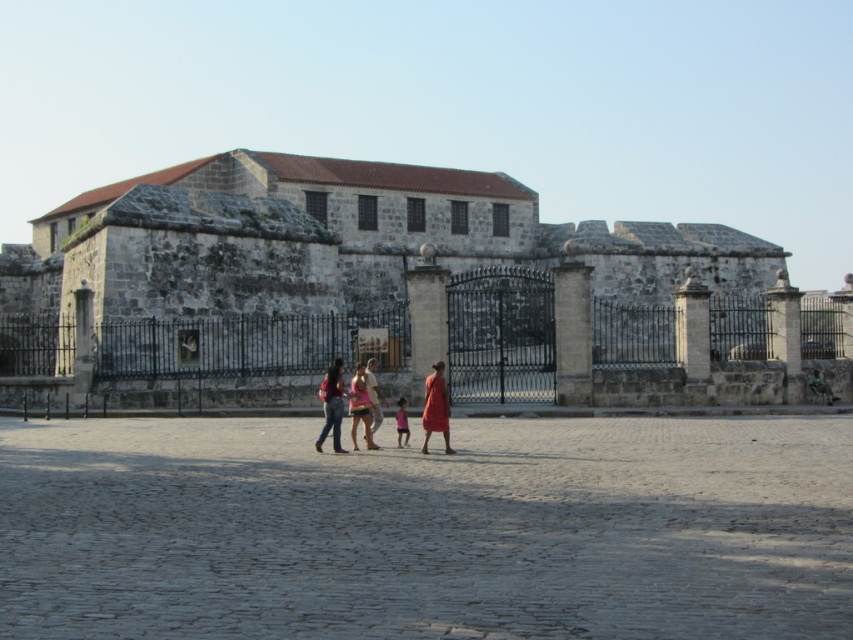
Looking at this image, can you confirm if gray cobblestone plaza at center is positioned below matte black pants at center?

Yes, gray cobblestone plaza at center is below matte black pants at center.

Between gray cobblestone plaza at center and matte black pants at center, which one has less height?

Standing shorter between the two is gray cobblestone plaza at center.

You are a GUI agent. You are given a task and a screenshot of the screen. Output one action in this format:
    pyautogui.click(x=<x>, y=<y>)
    Task: Click on the gray cobblestone plaza at center
    This screenshot has width=853, height=640.
    Given the screenshot: What is the action you would take?
    pyautogui.click(x=427, y=531)

Is matte black pants at center smaller than pink satin dress at center?

Incorrect, matte black pants at center is not smaller in size than pink satin dress at center.

Image resolution: width=853 pixels, height=640 pixels. Describe the element at coordinates (331, 404) in the screenshot. I see `matte black pants at center` at that location.

Which is behind, point (328, 384) or point (360, 401)?

The point (328, 384) is behind.

At what (x,y) coordinates should I click in order to perform the action: click on matte black pants at center. Please return your answer as a coordinate pair (x, y). Image resolution: width=853 pixels, height=640 pixels. Looking at the image, I should click on (331, 404).

Can you confirm if matte orange dress at center is positioned below pink fabric dress at center?

Incorrect, matte orange dress at center is not positioned below pink fabric dress at center.

Does matte orange dress at center appear on the right side of pink fabric dress at center?

Correct, you'll find matte orange dress at center to the right of pink fabric dress at center.

What are the coordinates of `matte orange dress at center` in the screenshot? It's located at (434, 404).